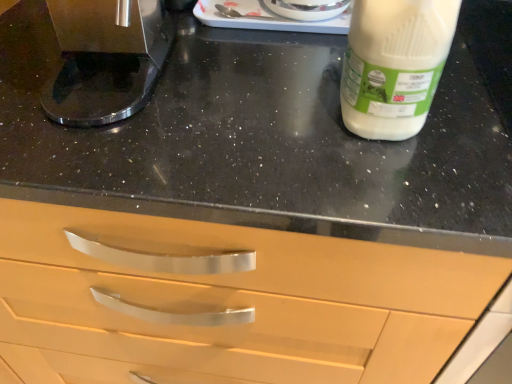
Question: From a real-world perspective, is shiny metallic coffee machine at left over white plastic bottle at upper right?

Choices:
 (A) no
 (B) yes

Answer: (A)

Question: Is shiny metallic coffee machine at left far away from white plastic bottle at upper right?

Choices:
 (A) yes
 (B) no

Answer: (B)

Question: Can you confirm if shiny metallic coffee machine at left is positioned to the left of white plastic bottle at upper right?

Choices:
 (A) yes
 (B) no

Answer: (A)

Question: Is shiny metallic coffee machine at left next to white plastic bottle at upper right?

Choices:
 (A) yes
 (B) no

Answer: (B)

Question: Does shiny metallic coffee machine at left have a smaller size compared to white plastic bottle at upper right?

Choices:
 (A) yes
 (B) no

Answer: (B)

Question: Is shiny metallic coffee machine at left facing away from white plastic bottle at upper right?

Choices:
 (A) no
 (B) yes

Answer: (A)

Question: From a real-world perspective, is white plastic bottle at upper right under shiny metallic coffee machine at left?

Choices:
 (A) no
 (B) yes

Answer: (A)

Question: Is white plastic bottle at upper right smaller than shiny metallic coffee machine at left?

Choices:
 (A) yes
 (B) no

Answer: (A)

Question: Considering the relative positions of white plastic bottle at upper right and shiny metallic coffee machine at left in the image provided, is white plastic bottle at upper right behind shiny metallic coffee machine at left?

Choices:
 (A) yes
 (B) no

Answer: (B)

Question: From the image's perspective, does white plastic bottle at upper right appear lower than shiny metallic coffee machine at left?

Choices:
 (A) no
 (B) yes

Answer: (B)

Question: Is white plastic bottle at upper right not inside shiny metallic coffee machine at left?

Choices:
 (A) yes
 (B) no

Answer: (A)

Question: Is shiny metallic coffee machine at left inside white plastic bottle at upper right?

Choices:
 (A) no
 (B) yes

Answer: (A)

Question: From the image's perspective, is shiny metallic coffee machine at left above or below white plastic bottle at upper right?

Choices:
 (A) below
 (B) above

Answer: (B)